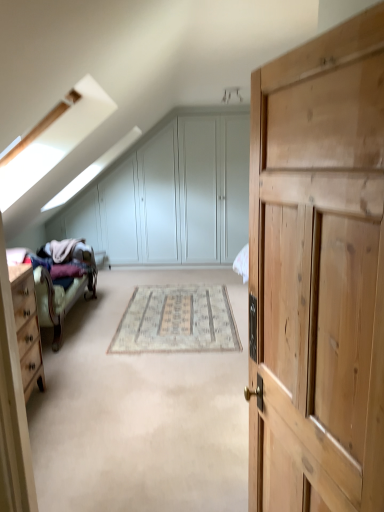
Question: Is beige woven rug at center to the left or to the right of velvet purple blanket at left in the image?

Choices:
 (A) left
 (B) right

Answer: (B)

Question: From a real-world perspective, is beige woven rug at center positioned above or below velvet purple blanket at left?

Choices:
 (A) below
 (B) above

Answer: (A)

Question: Estimate the real-world distances between objects in this image. Which object is closer to the velvet purple blanket at left?

Choices:
 (A) light wood dresser at left
 (B) wooden bed frame at left
 (C) natural wood cupboard at right
 (D) beige woven rug at center
 (E) white matte dresser at upper center

Answer: (B)

Question: Based on their relative distances, which object is farther from the white matte dresser at upper center?

Choices:
 (A) light wood dresser at left
 (B) natural wood cupboard at right
 (C) wooden bed frame at left
 (D) beige woven rug at center
 (E) velvet purple blanket at left

Answer: (B)